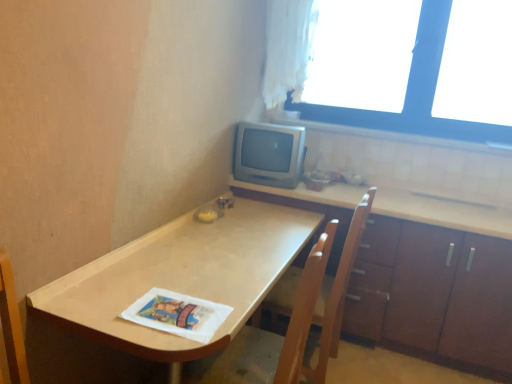
Describe the element at coordinates (178, 314) in the screenshot. This screenshot has height=384, width=512. I see `white paper magazine at lower center` at that location.

At what (x,y) coordinates should I click in order to perform the action: click on wooden swivel chair at center. Please return your answer as a coordinate pair (x, y). Looking at the image, I should click on (269, 336).

What do you see at coordinates (268, 154) in the screenshot?
I see `satin silver monitor at upper right` at bounding box center [268, 154].

In order to face matte wood table at center, should I rotate leftwards or rightwards?

To align with it, rotate left about 4.984°.

What is the approximate width of matte wood table at center?

matte wood table at center is 24.39 inches wide.

Locate an element on the screen. This screenshot has height=384, width=512. brown wood cabinet at lower right is located at coordinates pos(433,293).

Find the location of `white paper magazine at lower center`. white paper magazine at lower center is located at coordinates (178, 314).

Would you consider wooden swivel chair at center to be distant from satin silver monitor at upper right?

That's not correct — wooden swivel chair at center is a little close to satin silver monitor at upper right.

Is wooden swivel chair at center turned away from satin silver monitor at upper right?

No.

Considering the sizes of objects wooden swivel chair at center and satin silver monitor at upper right in the image provided, who is shorter, wooden swivel chair at center or satin silver monitor at upper right?

With less height is satin silver monitor at upper right.

Is wooden swivel chair at center to the left of satin silver monitor at upper right from the viewer's perspective?

Correct, you'll find wooden swivel chair at center to the left of satin silver monitor at upper right.

Is transparent glass window at upper right oriented away from white sheer curtain at upper right?

No, transparent glass window at upper right is not facing away from white sheer curtain at upper right.

Does transparent glass window at upper right contain white sheer curtain at upper right?

No, white sheer curtain at upper right is not inside transparent glass window at upper right.

Considering the points (507, 131) and (270, 56), which point is behind, point (507, 131) or point (270, 56)?

The point (270, 56) is farther.

Based on the photo, is transparent glass window at upper right taller than white sheer curtain at upper right?

Indeed, transparent glass window at upper right has a greater height compared to white sheer curtain at upper right.

Is white sheer curtain at upper right shorter than brown wood cabinet at lower right?

Yes.

How different are the orientations of white sheer curtain at upper right and brown wood cabinet at lower right in degrees?

1.76 degrees separate the facing orientations of white sheer curtain at upper right and brown wood cabinet at lower right.

Does point (293, 101) come behind point (378, 208)?

Yes, point (293, 101) is behind point (378, 208).

From the image's perspective, is white sheer curtain at upper right positioned above or below brown wood cabinet at lower right?

white sheer curtain at upper right is situated higher than brown wood cabinet at lower right in the image.

In terms of width, does brown wood cabinet at lower right look wider or thinner when compared to white paper magazine at lower center?

Clearly, brown wood cabinet at lower right has more width compared to white paper magazine at lower center.

Is white paper magazine at lower center located within brown wood cabinet at lower right?

No, white paper magazine at lower center is not a part of brown wood cabinet at lower right.

Is brown wood cabinet at lower right far away from white paper magazine at lower center?

brown wood cabinet at lower right is positioned a significant distance from white paper magazine at lower center.

Considering the relative positions of transparent glass window at upper right and wooden swivel chair at center in the image provided, is transparent glass window at upper right to the left or to the right of wooden swivel chair at center?

In the image, transparent glass window at upper right appears on the right side of wooden swivel chair at center.

From the image's perspective, relative to wooden swivel chair at center, is transparent glass window at upper right above or below?

Based on their image positions, transparent glass window at upper right is located above wooden swivel chair at center.

Considering the relative sizes of transparent glass window at upper right and wooden swivel chair at center in the image provided, is transparent glass window at upper right thinner than wooden swivel chair at center?

Correct, the width of transparent glass window at upper right is less than that of wooden swivel chair at center.

How different are the orientations of transparent glass window at upper right and wooden swivel chair at center in degrees?

The facing directions of transparent glass window at upper right and wooden swivel chair at center are 86.3 degrees apart.

Who is shorter, satin silver monitor at upper right or wooden swivel chair at center?

satin silver monitor at upper right.

Measure the distance between satin silver monitor at upper right and wooden swivel chair at center.

A distance of 36.13 inches exists between satin silver monitor at upper right and wooden swivel chair at center.

Could wooden swivel chair at center be considered to be inside satin silver monitor at upper right?

No, satin silver monitor at upper right does not contain wooden swivel chair at center.

Is satin silver monitor at upper right not close to wooden swivel chair at center?

satin silver monitor at upper right is near wooden swivel chair at center, not far away.

Is white sheer curtain at upper right aimed at transparent glass window at upper right?

No, white sheer curtain at upper right is not facing towards transparent glass window at upper right.

I want to click on window below the white sheer curtain at upper right (from a real-world perspective), so click(414, 92).

Is white sheer curtain at upper right to the left of transparent glass window at upper right from the viewer's perspective?

Yes.

From a real-world perspective, between white sheer curtain at upper right and transparent glass window at upper right, who is vertically lower?

In real-world perspective, transparent glass window at upper right is lower.

At what (x,y) coordinates should I click in order to perform the action: click on computer monitor on the right of the wooden swivel chair at center. Please return your answer as a coordinate pair (x, y). Looking at the image, I should click on (268, 154).

Identify the location of window that appears below the white sheer curtain at upper right (from the image's perspective). The height and width of the screenshot is (384, 512). (414, 92).

Estimate the real-world distances between objects in this image. Which object is closer to brown wood cabinet at lower right, wooden chair at center or white paper magazine at lower center?

Based on the image, wooden chair at center appears to be nearer to brown wood cabinet at lower right.

Considering their positions, is brown wood cabinet at lower right positioned closer to wooden chair at center than white sheer curtain at upper right?

Based on the image, brown wood cabinet at lower right appears to be nearer to wooden chair at center.

Looking at the image, which one is located further to wooden chair at center, brown wood cabinet at lower right or matte wood table at center?

brown wood cabinet at lower right is further to wooden chair at center.

From the image, which object appears to be nearer to matte wood table at center, white paper magazine at lower center or wooden chair at center?

white paper magazine at lower center.

When comparing their distances from brown wood cabinet at lower right, does transparent glass window at upper right or white sheer curtain at upper right seem further?

Among the two, white sheer curtain at upper right is located further to brown wood cabinet at lower right.

When comparing their distances from satin silver monitor at upper right, does white sheer curtain at upper right or transparent glass window at upper right seem further?

transparent glass window at upper right is positioned further to the anchor satin silver monitor at upper right.

Which object lies further to the anchor point satin silver monitor at upper right, white sheer curtain at upper right or white paper magazine at lower center?

white paper magazine at lower center.

Considering their positions, is brown wood cabinet at lower right positioned further to white paper magazine at lower center than white sheer curtain at upper right?

Based on the image, white sheer curtain at upper right appears to be further to white paper magazine at lower center.

Locate an element on the screen. The image size is (512, 384). cabinetry positioned between white paper magazine at lower center and satin silver monitor at upper right from near to far is located at coordinates (433, 293).

Locate an element on the screen. The width and height of the screenshot is (512, 384). swivel chair between white paper magazine at lower center and brown wood cabinet at lower right is located at coordinates (269, 336).

The image size is (512, 384). Find the location of `armchair that lies between transparent glass window at upper right and wooden swivel chair at center from top to bottom`. armchair that lies between transparent glass window at upper right and wooden swivel chair at center from top to bottom is located at coordinates (337, 292).

I want to click on armchair positioned between matte wood table at center and brown wood cabinet at lower right from near to far, so click(337, 292).